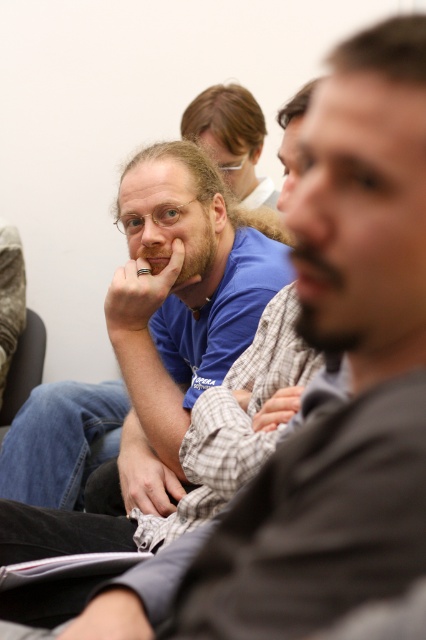
Where is the matte blue shirt at center located in the image?

The matte blue shirt at center is located at point (230, 140) in the image.